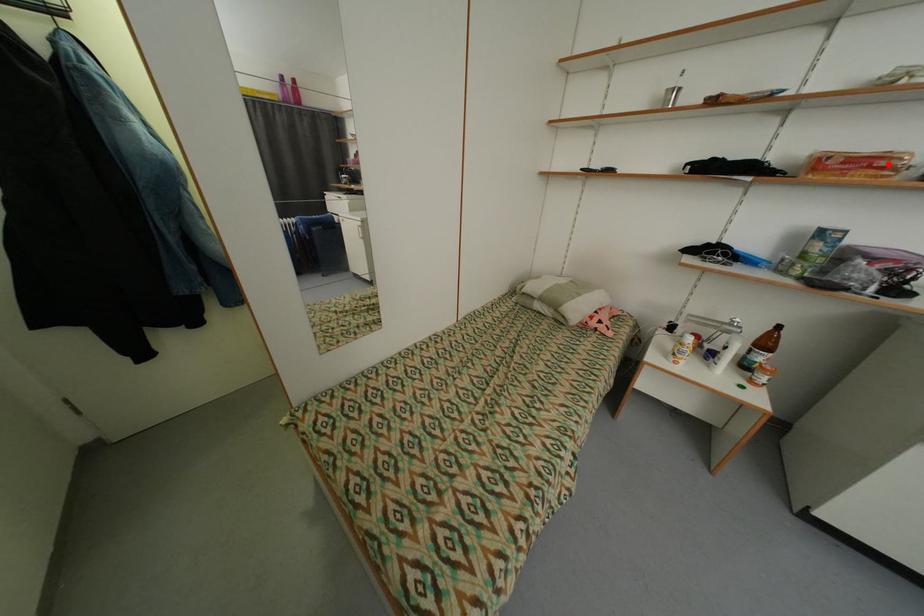
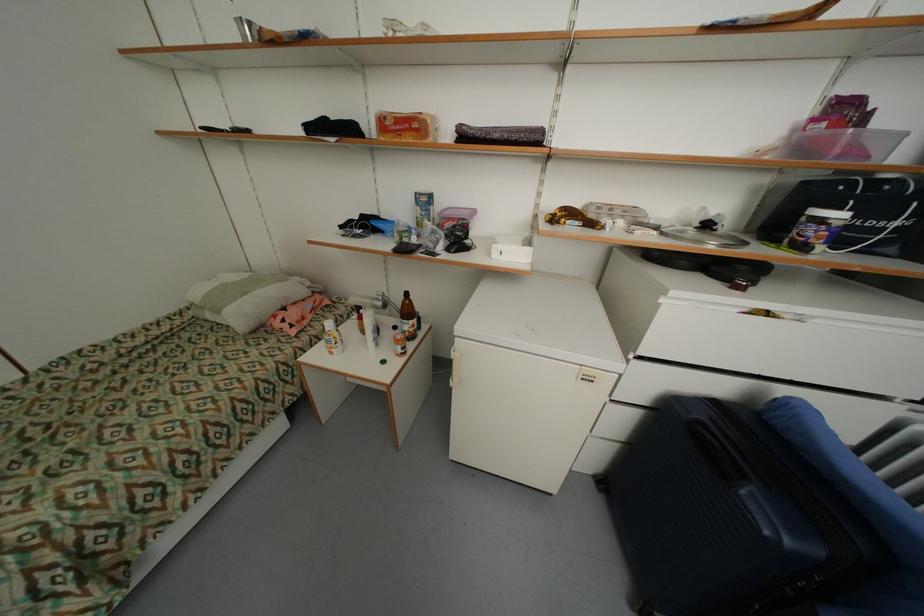
Where in the second image is the point corresponding to the highlighted location from the first image?

(421, 126)